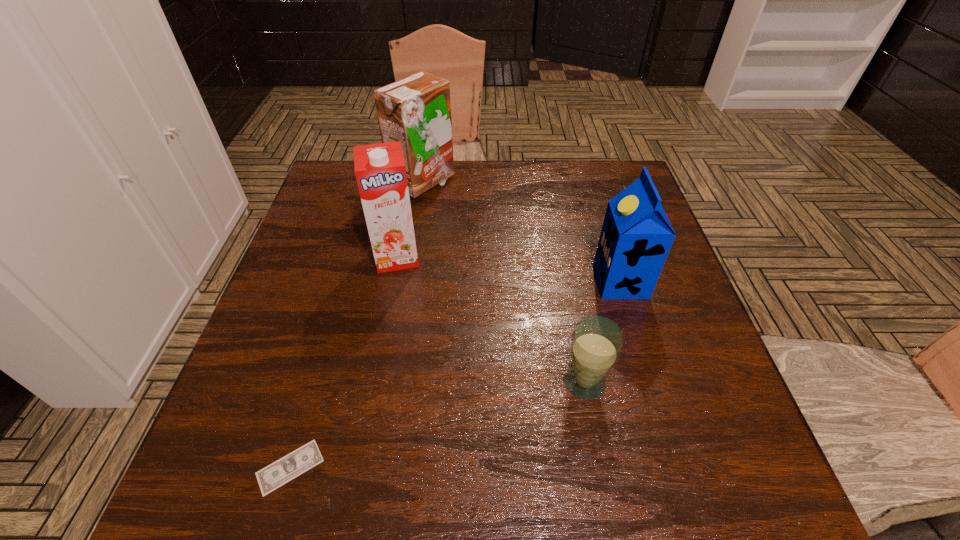
This screenshot has width=960, height=540. I want to click on the farthest object, so click(x=416, y=110).

The image size is (960, 540). I want to click on the rightmost carton, so click(636, 237).

The image size is (960, 540). I want to click on glass, so click(597, 343).

Locate an element on the screen. the fourth object from left to right is located at coordinates (597, 343).

Identify the location of the nearest object. This screenshot has width=960, height=540. (275, 475).

Image resolution: width=960 pixels, height=540 pixels. I want to click on money, so click(x=275, y=475).

Where is `vacant space situated 0.320m on the straw side of the farthest carton`? This screenshot has height=540, width=960. vacant space situated 0.320m on the straw side of the farthest carton is located at coordinates (563, 183).

This screenshot has width=960, height=540. In order to click on vacant space located 0.300m with the cap open on the rightmost carton in this screenshot , I will do `click(467, 281)`.

This screenshot has width=960, height=540. Find the location of `vacant area situated 0.340m with the cap open on the rightmost carton`. vacant area situated 0.340m with the cap open on the rightmost carton is located at coordinates (449, 281).

Locate an element on the screen. blank space located with the cap open on the rightmost carton is located at coordinates (575, 281).